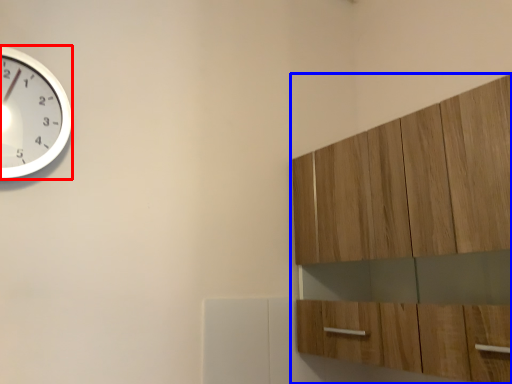
Question: Which of the following is the closest to the observer, wall clock (highlighted by a red box) or cabinetry (highlighted by a blue box)?

Choices:
 (A) wall clock
 (B) cabinetry

Answer: (B)